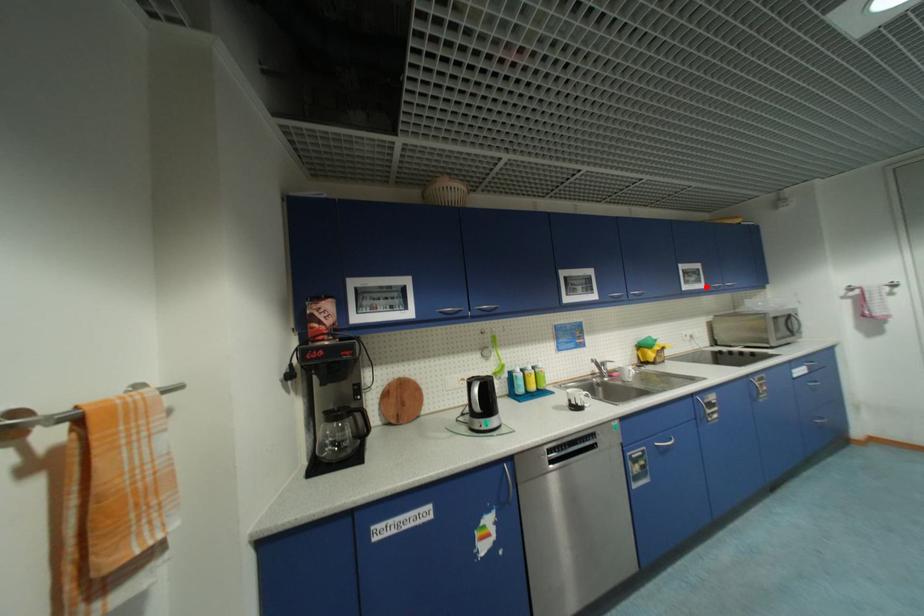
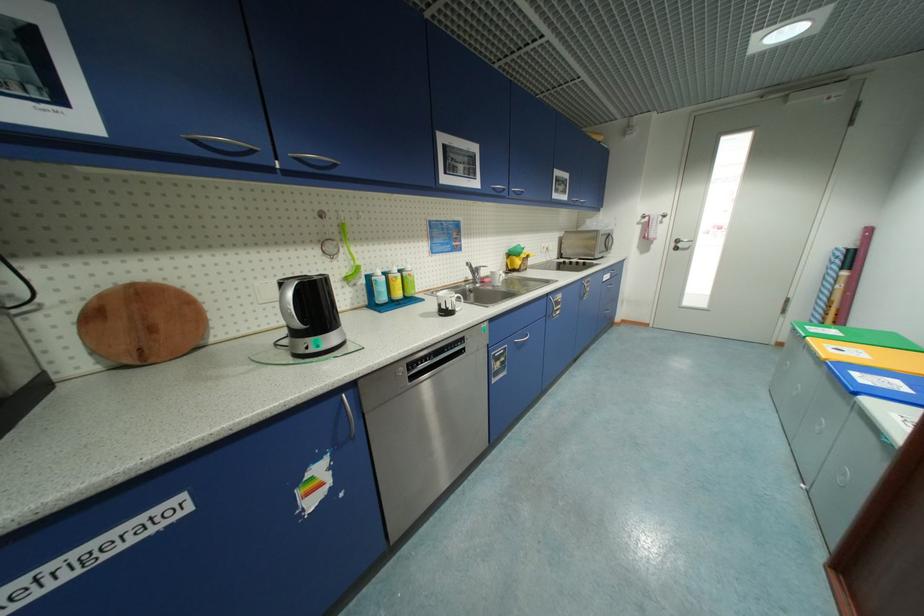
Question: I am providing you with two images of the same scene from different viewpoints. A red point is marked on the first image. Is the red point's position out of view in image 2?

Choices:
 (A) Yes
 (B) No

Answer: (B)